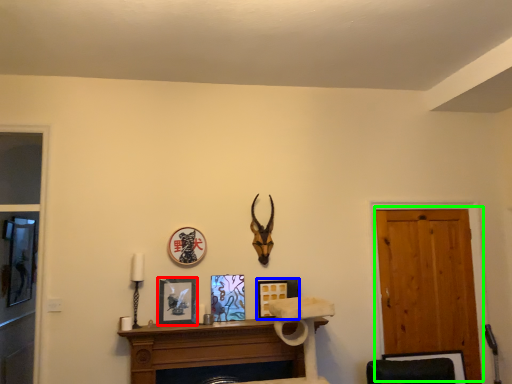
Question: Estimate the real-world distances between objects in this image. Which object is closer to picture frame (highlighted by a red box), picture frame (highlighted by a blue box) or door (highlighted by a green box)?

Choices:
 (A) picture frame
 (B) door

Answer: (A)